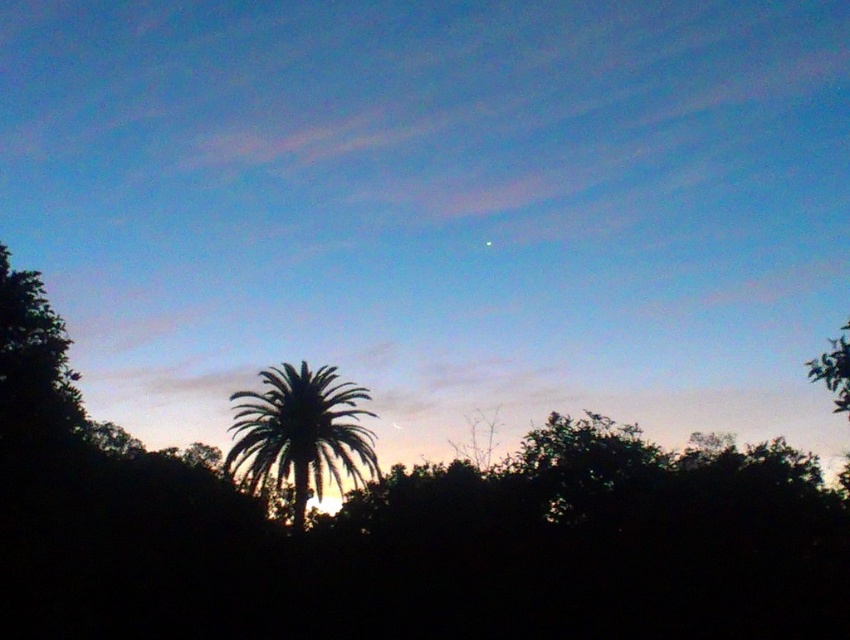
Which of these two, silhouette leafy tree at center or silhouette leafy palm at center, stands taller?

silhouette leafy tree at center is taller.

Who is more distant from viewer, (x=60, y=403) or (x=248, y=401)?

Point (x=248, y=401)

Between point (660, 636) and point (252, 484), which one is positioned in front?

Positioned in front is point (660, 636).

The image size is (850, 640). I want to click on silhouette leafy tree at center, so click(398, 532).